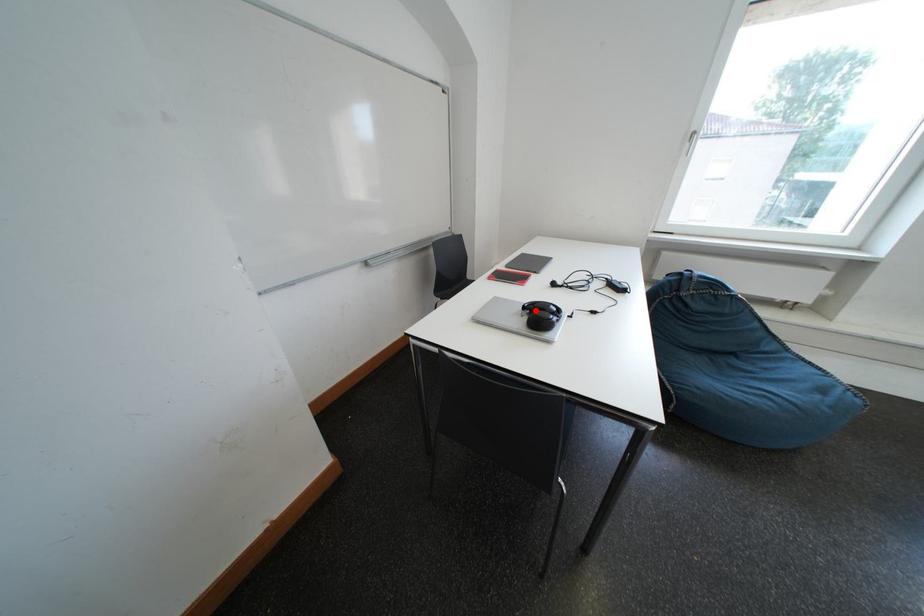
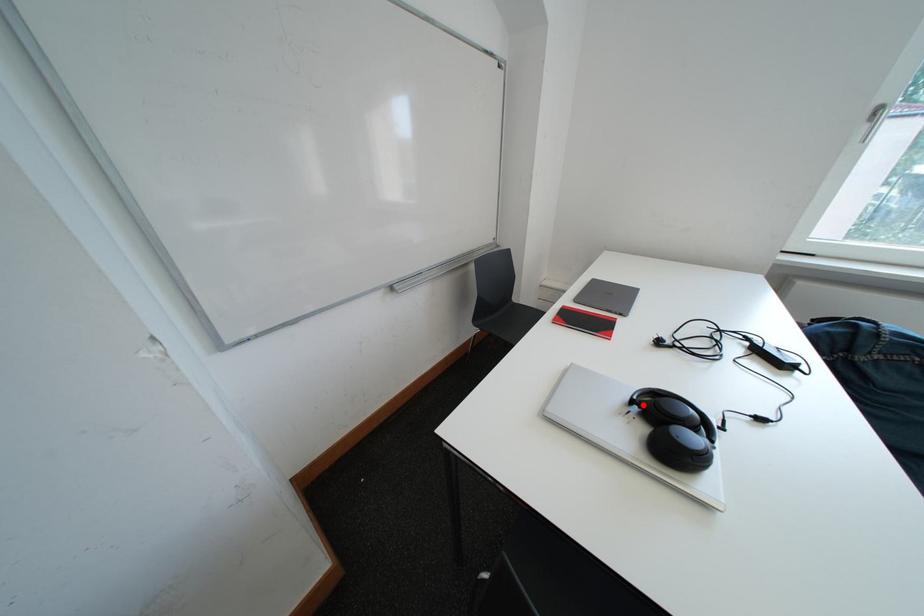
I am providing you with two images of the same scene from different viewpoints. A red point is marked on the first image and another point is marked on the second image. Is the marked point in image1 the same physical position as the marked point in image2?

Yes